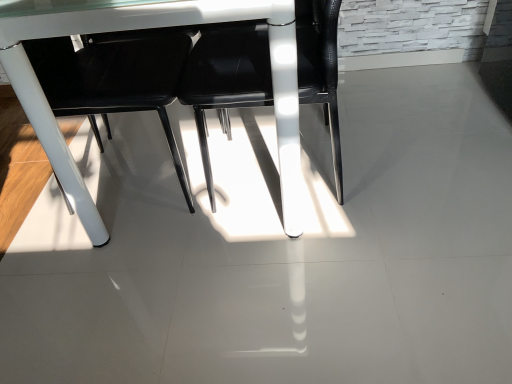
This screenshot has height=384, width=512. Find the location of `vacant area that lies between white glossy table at center and black leather chair at center, which is the 1th chair from left to right`. vacant area that lies between white glossy table at center and black leather chair at center, which is the 1th chair from left to right is located at coordinates (109, 146).